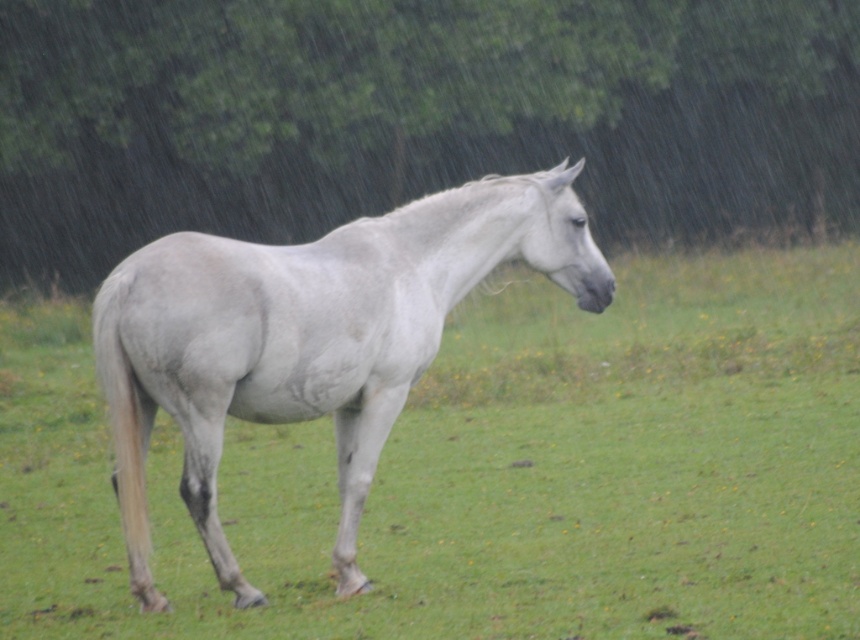
Question: Is green leafy tree at upper center thinner than gray matte horse at center?

Choices:
 (A) no
 (B) yes

Answer: (A)

Question: Is green leafy tree at upper center behind gray matte horse at center?

Choices:
 (A) yes
 (B) no

Answer: (A)

Question: Which point is farther to the camera?

Choices:
 (A) gray matte horse at center
 (B) green leafy tree at upper center

Answer: (B)

Question: Which object is closer to the camera taking this photo?

Choices:
 (A) green leafy tree at upper center
 (B) gray matte horse at center

Answer: (B)

Question: Is green leafy tree at upper center to the right of gray matte horse at center from the viewer's perspective?

Choices:
 (A) no
 (B) yes

Answer: (B)